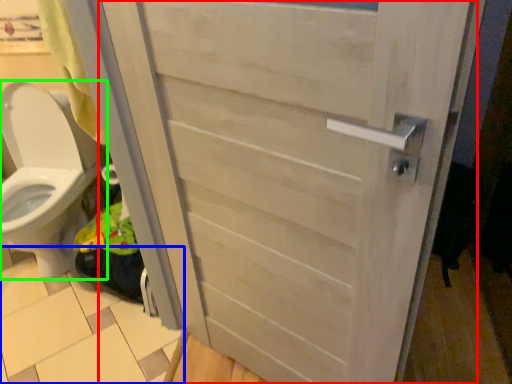
Question: Estimate the real-world distances between objects in this image. Which object is closer to door (highlighted by a red box), tile (highlighted by a blue box) or toilet (highlighted by a green box)?

Choices:
 (A) tile
 (B) toilet

Answer: (A)